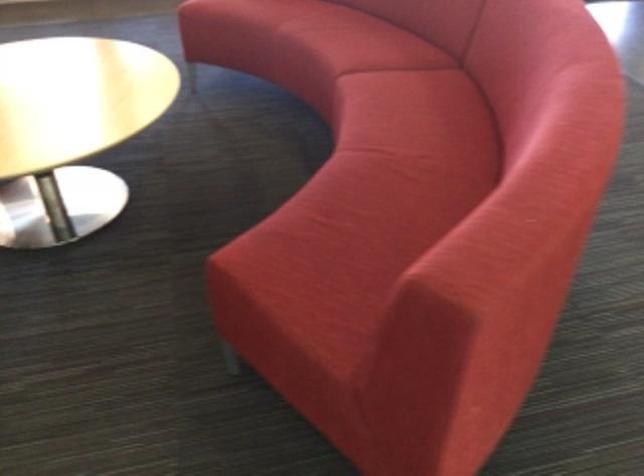
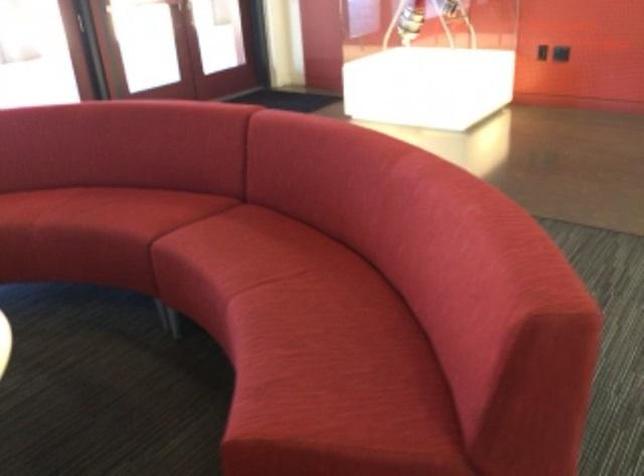
Question: The camera is either moving clockwise (left) or counter-clockwise (right) around the object. The first image is from the beginning of the video and the second image is from the end. Is the camera moving left or right when shooting the video?

Choices:
 (A) Left
 (B) Right

Answer: (A)